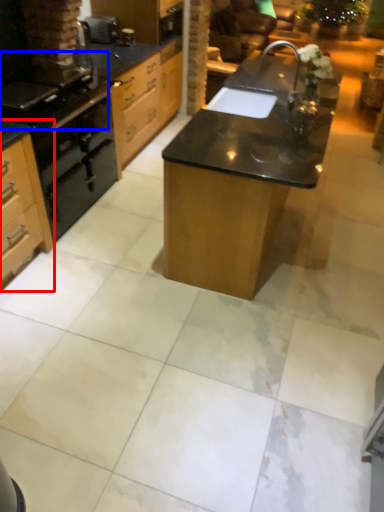
Question: Which of the following is the closest to the observer, cabinetry (highlighted by a red box) or gas stove (highlighted by a blue box)?

Choices:
 (A) cabinetry
 (B) gas stove

Answer: (A)